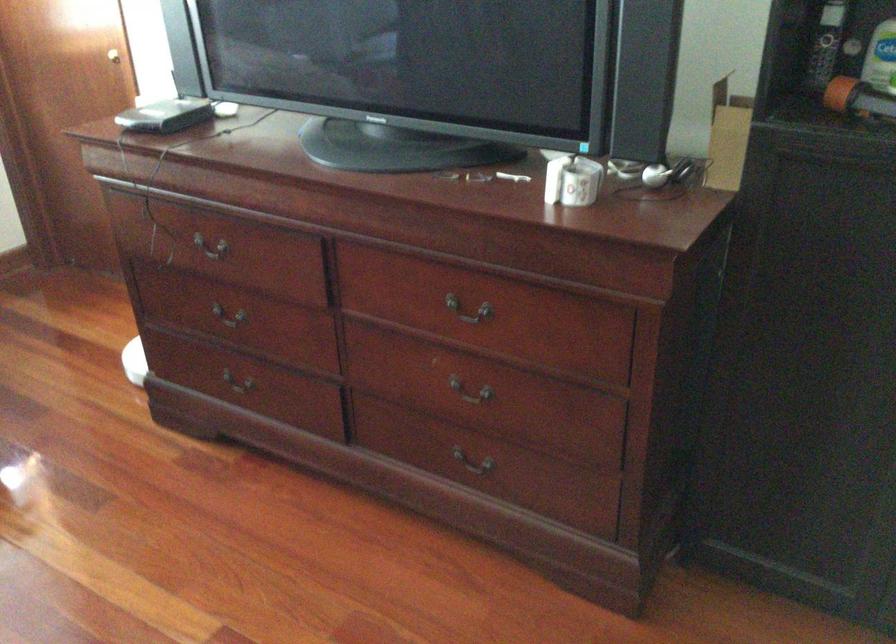
Find where to lift the small black box. Please return your answer as a coordinate pair (x, y).

(165, 116)